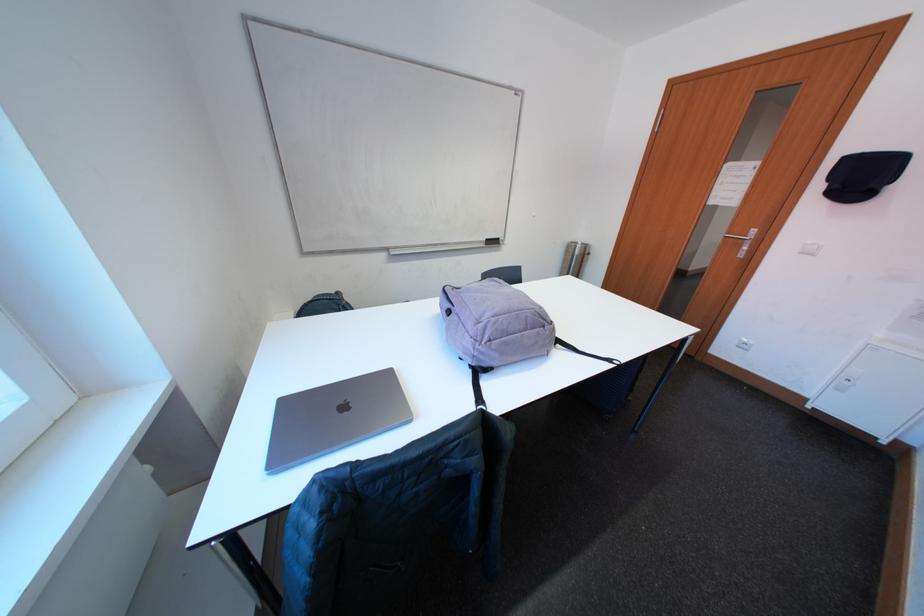
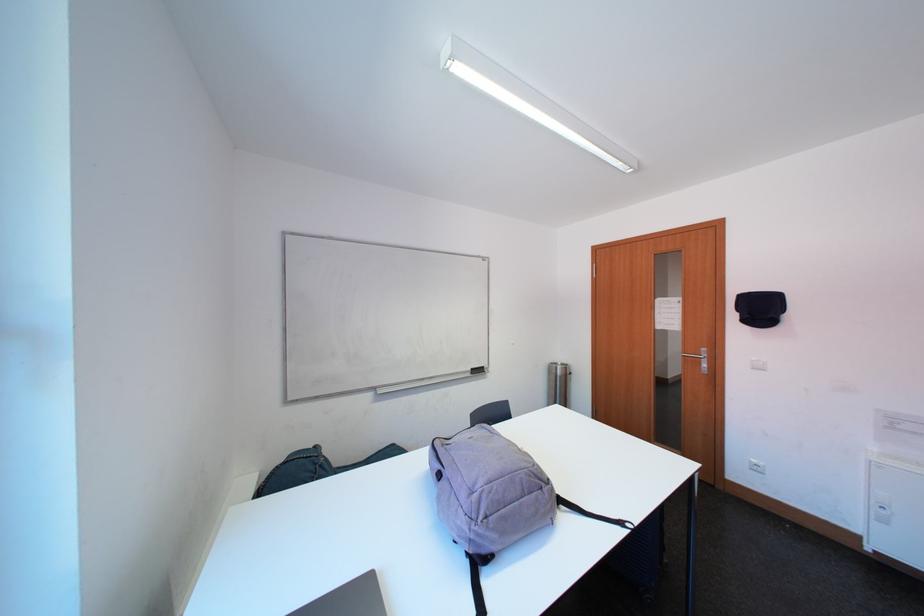
The point at (553, 330) is marked in the first image. Where is the corresponding point in the second image?

(551, 492)